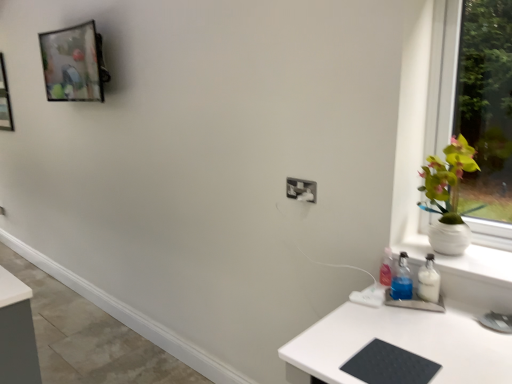
Measure the distance between point (91, 31) and camera.

The distance of point (91, 31) from camera is 2.50 meters.

Find the location of a particular element. The height and width of the screenshot is (384, 512). white plastic electric outlet at center is located at coordinates (301, 190).

The image size is (512, 384). What do you see at coordinates (301, 190) in the screenshot? I see `white plastic electric outlet at center` at bounding box center [301, 190].

What are the coordinates of `metallic glass picture frame at upper left` in the screenshot? It's located at (74, 63).

From the image's perspective, between metallic glass picture frame at upper left and white plastic electric outlet at center, which one is located above?

metallic glass picture frame at upper left, from the image's perspective.

Considering the sizes of metallic glass picture frame at upper left and white plastic electric outlet at center in the image, is metallic glass picture frame at upper left bigger or smaller than white plastic electric outlet at center?

Clearly, metallic glass picture frame at upper left is larger in size than white plastic electric outlet at center.

Can you confirm if metallic glass picture frame at upper left is wider than white plastic electric outlet at center?

Yes, metallic glass picture frame at upper left is wider than white plastic electric outlet at center.

Is metallic glass picture frame at upper left looking in the opposite direction of white plastic electric outlet at center?

metallic glass picture frame at upper left is not turned away from white plastic electric outlet at center.

Is metallic glass picture frame at upper left situated inside white ceramic vase at right or outside?

metallic glass picture frame at upper left is located beyond the bounds of white ceramic vase at right.

Is metallic glass picture frame at upper left oriented towards white ceramic vase at right?

No, metallic glass picture frame at upper left is not turned towards white ceramic vase at right.

In the scene shown: Which point is more forward, [41,33] or [444,203]?

The point [444,203] is in front.

Where is `houseplant below the metallic glass picture frame at upper left (from the image's perspective)`? This screenshot has width=512, height=384. houseplant below the metallic glass picture frame at upper left (from the image's perspective) is located at coordinates (448, 196).

From the picture: Is white ceramic vase at right positioned far away from metallic glass picture frame at upper left?

Yes, white ceramic vase at right and metallic glass picture frame at upper left are located far from each other.

From a real-world perspective, is white ceramic vase at right on metallic glass picture frame at upper left?

No, from a real-world perspective, white ceramic vase at right is not on top of metallic glass picture frame at upper left.

Can you confirm if white ceramic vase at right is positioned to the left of metallic glass picture frame at upper left?

No.

Is white ceramic vase at right spatially inside metallic glass picture frame at upper left, or outside of it?

white ceramic vase at right lies outside metallic glass picture frame at upper left.

Looking at this image, considering the sizes of objects black rubberized mat at lower right and white ceramic vase at right in the image provided, who is thinner, black rubberized mat at lower right or white ceramic vase at right?

Thinner between the two is white ceramic vase at right.

What's the angular difference between black rubberized mat at lower right and white ceramic vase at right's facing directions?

They differ by 0.000957 degrees in their facing directions.

Is the surface of black rubberized mat at lower right in direct contact with white ceramic vase at right?

There is a gap between black rubberized mat at lower right and white ceramic vase at right.

Image resolution: width=512 pixels, height=384 pixels. I want to click on houseplant lying on the right of black rubberized mat at lower right, so click(448, 196).

Can you confirm if white plastic electric outlet at center is bigger than black rubberized mat at lower right?

No, white plastic electric outlet at center is not bigger than black rubberized mat at lower right.

Is white plastic electric outlet at center positioned before black rubberized mat at lower right?

That is False.

Image resolution: width=512 pixels, height=384 pixels. Identify the location of desk that is below the white plastic electric outlet at center (from the image's perspective). click(x=401, y=343).

Does white ceramic vase at right appear on the left side of black rubberized mat at lower right?

No, white ceramic vase at right is not to the left of black rubberized mat at lower right.

Can you confirm if white ceramic vase at right is wider than black rubberized mat at lower right?

No, white ceramic vase at right is not wider than black rubberized mat at lower right.

Does white ceramic vase at right touch black rubberized mat at lower right?

white ceramic vase at right is not next to black rubberized mat at lower right, and they're not touching.

From the picture: From a real-world perspective, which is physically below, white ceramic vase at right or black rubberized mat at lower right?

In real-world perspective, black rubberized mat at lower right is lower.

Is metallic glass picture frame at upper left in front of or behind black rubberized mat at lower right in the image?

metallic glass picture frame at upper left is positioned farther from the viewer than black rubberized mat at lower right.

From the picture: Could you measure the distance between metallic glass picture frame at upper left and black rubberized mat at lower right?

A distance of 7.17 feet exists between metallic glass picture frame at upper left and black rubberized mat at lower right.

From a real-world perspective, is metallic glass picture frame at upper left over black rubberized mat at lower right?

Yes, from a real-world perspective, metallic glass picture frame at upper left is over black rubberized mat at lower right

Between metallic glass picture frame at upper left and black rubberized mat at lower right, which one has less height?

With less height is black rubberized mat at lower right.

You are a GUI agent. You are given a task and a screenshot of the screen. Output one action in this format:
    pyautogui.click(x=<x>, y=<y>)
    Task: Click on the electric outlet that is on the right side of metallic glass picture frame at upper left
    
    Given the screenshot: What is the action you would take?
    pyautogui.click(x=301, y=190)

In order to click on houseplant in front of the metallic glass picture frame at upper left in this screenshot , I will do `click(448, 196)`.

Considering their positions, is metallic glass picture frame at upper left positioned closer to white ceramic vase at right than black rubberized mat at lower right?

black rubberized mat at lower right is closer to white ceramic vase at right.

Looking at the image, which one is located closer to white ceramic vase at right, white plastic electric outlet at center or metallic glass picture frame at upper left?

white plastic electric outlet at center is positioned closer to the anchor white ceramic vase at right.

Looking at the image, which one is located closer to metallic glass picture frame at upper left, white ceramic vase at right or white plastic electric outlet at center?

white plastic electric outlet at center lies closer to metallic glass picture frame at upper left than the other object.

Estimate the real-world distances between objects in this image. Which object is further from black rubberized mat at lower right, metallic glass picture frame at upper left or white plastic electric outlet at center?

Among the two, metallic glass picture frame at upper left is located further to black rubberized mat at lower right.

When comparing their distances from white ceramic vase at right, does white plastic electric outlet at center or black rubberized mat at lower right seem further?

white plastic electric outlet at center.

Which object lies further to the anchor point white plastic electric outlet at center, black rubberized mat at lower right or white ceramic vase at right?

black rubberized mat at lower right.

Considering their positions, is metallic glass picture frame at upper left positioned further to black rubberized mat at lower right than white ceramic vase at right?

The object further to black rubberized mat at lower right is metallic glass picture frame at upper left.

Estimate the real-world distances between objects in this image. Which object is closer to metallic glass picture frame at upper left, white plastic electric outlet at center or black rubberized mat at lower right?

Based on the image, white plastic electric outlet at center appears to be nearer to metallic glass picture frame at upper left.

Image resolution: width=512 pixels, height=384 pixels. I want to click on houseplant between black rubberized mat at lower right and white plastic electric outlet at center in the front-back direction, so click(448, 196).

Find the location of `electric outlet between metallic glass picture frame at upper left and black rubberized mat at lower right`. electric outlet between metallic glass picture frame at upper left and black rubberized mat at lower right is located at coordinates (301, 190).

The width and height of the screenshot is (512, 384). Find the location of `desk between metallic glass picture frame at upper left and white ceramic vase at right from left to right`. desk between metallic glass picture frame at upper left and white ceramic vase at right from left to right is located at coordinates (401, 343).

Find the location of a particular element. Image resolution: width=512 pixels, height=384 pixels. electric outlet between metallic glass picture frame at upper left and white ceramic vase at right is located at coordinates (301, 190).